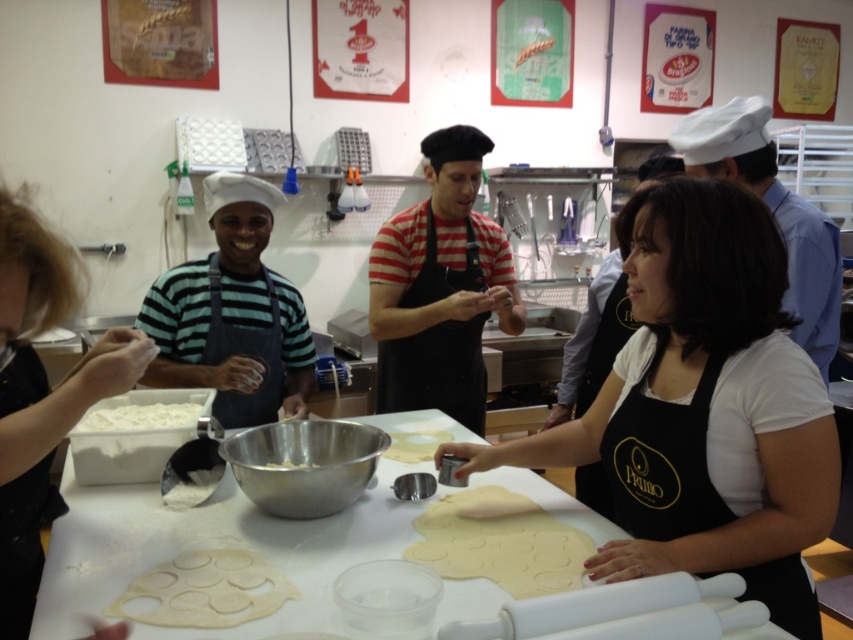
Can you confirm if striped cotton shirt at center is positioned above white matte bowl at center?

Indeed, striped cotton shirt at center is positioned over white matte bowl at center.

Does striped cotton shirt at center have a greater height compared to white matte bowl at center?

Correct, striped cotton shirt at center is much taller as white matte bowl at center.

This screenshot has height=640, width=853. I want to click on striped cotton shirt at center, so pyautogui.click(x=440, y=288).

Identify the location of striped cotton shirt at center. Image resolution: width=853 pixels, height=640 pixels. (440, 288).

Based on the photo, can you confirm if green striped shirt at center is positioned to the left of white dough at center?

Indeed, green striped shirt at center is positioned on the left side of white dough at center.

Does green striped shirt at center have a lesser width compared to white dough at center?

Incorrect, green striped shirt at center's width is not less than white dough at center's.

Is point (242, 358) closer to viewer compared to point (485, 508)?

That is False.

In order to click on green striped shirt at center in this screenshot , I will do `click(231, 314)`.

Between white dough at center and clear plastic dough at center, which one appears on the right side from the viewer's perspective?

white dough at center

Based on the photo, who is higher up, white dough at center or clear plastic dough at center?

white dough at center

I want to click on white dough at center, so click(x=498, y=541).